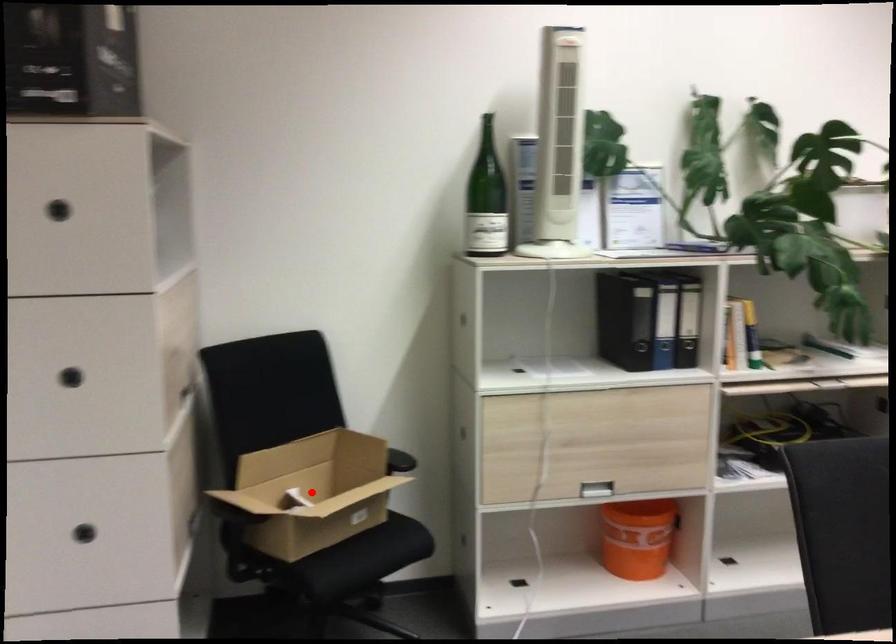
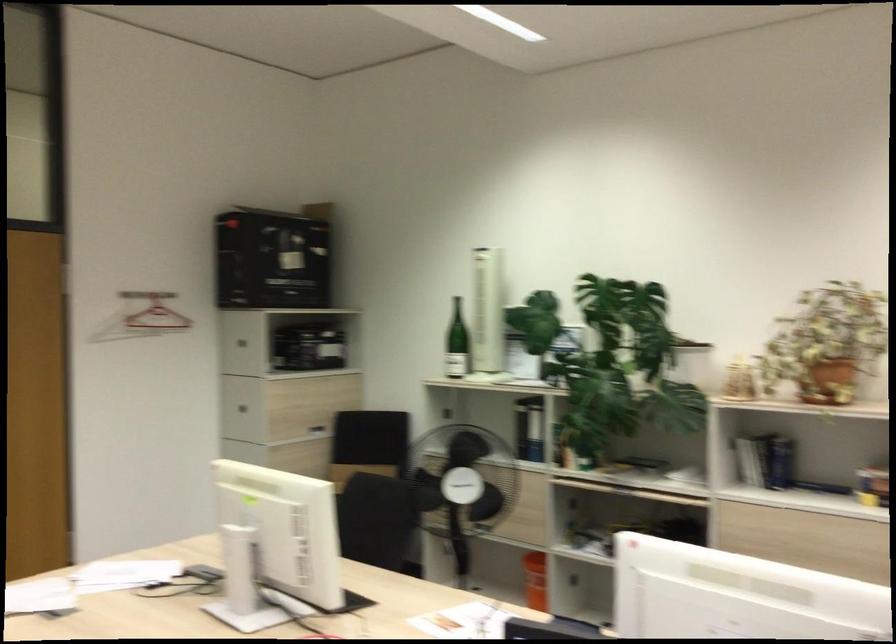
Question: I am providing you with two images of the same scene from different viewpoints. A red point is marked on the first image. Can you still see the location of the red point in image 2?

Choices:
 (A) Yes
 (B) No

Answer: (B)